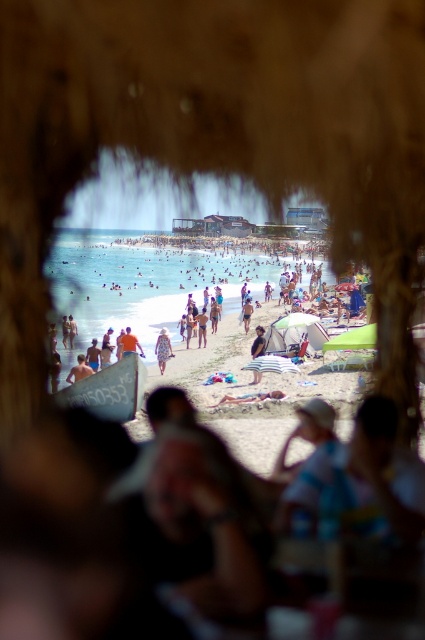
Question: Is striped fabric person at center closer to camera compared to white cotton dress at center?

Choices:
 (A) yes
 (B) no

Answer: (A)

Question: Which point is closer to the camera?

Choices:
 (A) white cotton dress at center
 (B) tan skin person at lower left
 (C) white fabric towel at center
 (D) orange t-shirt at center

Answer: (C)

Question: Which of the following is the closest to the observer?

Choices:
 (A) tan skin person at lower left
 (B) striped fabric person at center

Answer: (A)

Question: Is patterned fabric dress at center in front of tan skin person at lower left?

Choices:
 (A) no
 (B) yes

Answer: (A)

Question: Which object is the farthest from the striped fabric person at center?

Choices:
 (A) blue fabric umbrella at center
 (B) white fabric towel at center

Answer: (A)

Question: Does white fabric towel at center have a smaller size compared to striped fabric person at center?

Choices:
 (A) yes
 (B) no

Answer: (A)